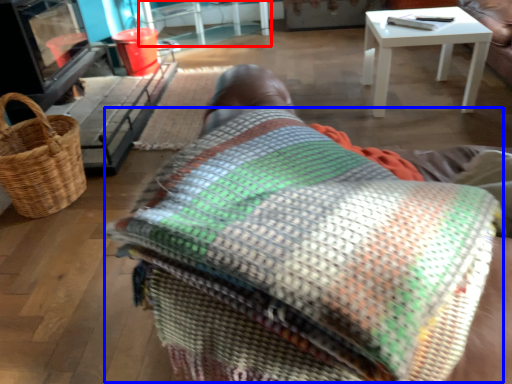
Question: Which point is closer to the camera, table (highlighted by a red box) or blanket (highlighted by a blue box)?

Choices:
 (A) table
 (B) blanket

Answer: (B)